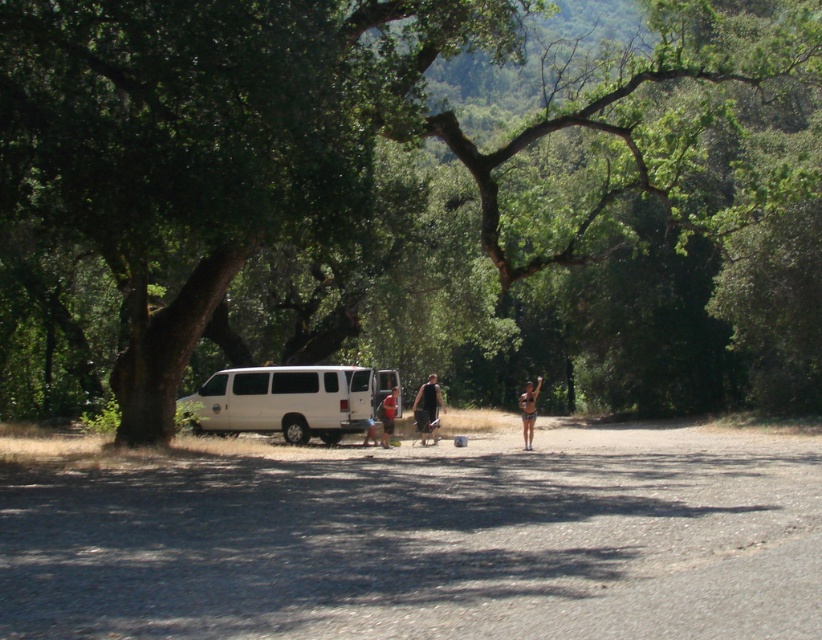
The width and height of the screenshot is (822, 640). Describe the element at coordinates (529, 410) in the screenshot. I see `tan skin bikini at center` at that location.

Between point (538, 387) and point (382, 406), which one is positioned in front?

Positioned in front is point (382, 406).

This screenshot has height=640, width=822. What are the coordinates of `tan skin bikini at center` in the screenshot? It's located at (529, 410).

Does green leafy tree at center appear over black fabric shorts at center?

Yes, green leafy tree at center is above black fabric shorts at center.

Can you confirm if green leafy tree at center is positioned below black fabric shorts at center?

Actually, green leafy tree at center is above black fabric shorts at center.

Image resolution: width=822 pixels, height=640 pixels. Find the location of `green leafy tree at center`. green leafy tree at center is located at coordinates (409, 200).

You are a GUI agent. You are given a task and a screenshot of the screen. Output one action in this format:
    pyautogui.click(x=<x>, y=<y>)
    Task: Click on the green leafy tree at center
    The image size is (822, 640).
    Given the screenshot: What is the action you would take?
    pyautogui.click(x=409, y=200)

Is point (788, 166) positioned behind point (389, 396)?

Yes, point (788, 166) is behind point (389, 396).

Can you confirm if green leafy tree at center is taller than orange fabric shirt at center?

Yes, green leafy tree at center is taller than orange fabric shirt at center.

Measure the distance between point (399,298) and camera.

A distance of 112.31 feet exists between point (399,298) and camera.

This screenshot has width=822, height=640. Identify the location of green leafy tree at center. (409, 200).